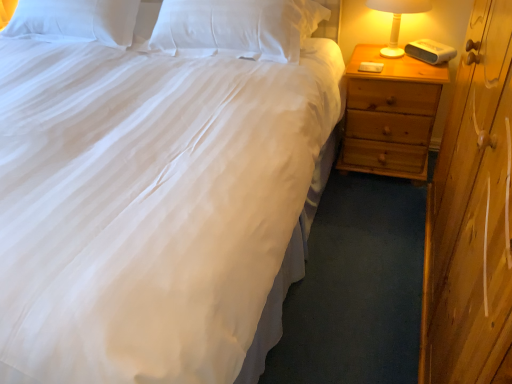
The image size is (512, 384). What do you see at coordinates (238, 26) in the screenshot?
I see `white soft pillow at upper center, the 2th pillow in the left-to-right sequence` at bounding box center [238, 26].

I want to click on white plastic lamp at right, so click(397, 19).

The height and width of the screenshot is (384, 512). Describe the element at coordinates (390, 115) in the screenshot. I see `light brown wood nightstand at right` at that location.

Image resolution: width=512 pixels, height=384 pixels. Find the location of `white soft pillow at upper center, the 2th pillow in the left-to-right sequence`. white soft pillow at upper center, the 2th pillow in the left-to-right sequence is located at coordinates (238, 26).

Image resolution: width=512 pixels, height=384 pixels. In order to click on bedside lamp located below the white soft pillow at upper left, the second pillow from the right (from the image's perspective) in this screenshot , I will do `click(397, 19)`.

Is point (381, 9) positioned after point (115, 34)?

No, (381, 9) is in front of (115, 34).

How many degrees apart are the facing directions of white plastic lamp at right and white soft pillow at upper left, acting as the 1th pillow starting from the left?

white plastic lamp at right and white soft pillow at upper left, acting as the 1th pillow starting from the left, are facing 0.000384 degrees away from each other.

Which is correct: white plastic lamp at right is inside white soft pillow at upper left, acting as the 1th pillow starting from the left, or outside of it?

white plastic lamp at right is located beyond the bounds of white soft pillow at upper left, acting as the 1th pillow starting from the left.

Is white soft pillow at upper left, the second pillow from the right, aimed at light brown wood nightstand at right?

No, white soft pillow at upper left, the second pillow from the right, is not oriented towards light brown wood nightstand at right.

Considering the relative sizes of white soft pillow at upper left, the second pillow from the right, and light brown wood nightstand at right in the image provided, is white soft pillow at upper left, the second pillow from the right, shorter than light brown wood nightstand at right?

Correct, white soft pillow at upper left, the second pillow from the right, is not as tall as light brown wood nightstand at right.

Would you consider white soft pillow at upper left, the second pillow from the right, to be distant from light brown wood nightstand at right?

Indeed, white soft pillow at upper left, the second pillow from the right, is not near light brown wood nightstand at right.

Identify the location of pillow in front of the light brown wood nightstand at right. This screenshot has height=384, width=512. (238, 26).

Which of these two, light brown wood nightstand at right or white soft pillow at upper center, the 2th pillow in the left-to-right sequence, is bigger?

With larger size is light brown wood nightstand at right.

Can you tell me how much light brown wood nightstand at right and white soft pillow at upper center, the 2th pillow in the left-to-right sequence, differ in facing direction?

2.29 degrees.

From their relative heights in the image, would you say light brown wood nightstand at right is taller or shorter than white soft pillow at upper center, which is the 1th pillow in right-to-left order?

In the image, light brown wood nightstand at right appears to be taller than white soft pillow at upper center, which is the 1th pillow in right-to-left order.

Considering the positions of point (27, 33) and point (210, 13), is point (27, 33) closer or farther from the camera than point (210, 13)?

Point (27, 33) is positioned farther from the camera compared to point (210, 13).

Is white soft pillow at upper left, acting as the 1th pillow starting from the left, aimed at white soft pillow at upper center, the 2th pillow in the left-to-right sequence?

No, white soft pillow at upper left, acting as the 1th pillow starting from the left, is not aimed at white soft pillow at upper center, the 2th pillow in the left-to-right sequence.

From the image's perspective, is white soft pillow at upper left, acting as the 1th pillow starting from the left, positioned above or below white soft pillow at upper center, the 2th pillow in the left-to-right sequence?

Clearly, from the image's perspective, white soft pillow at upper left, acting as the 1th pillow starting from the left, is above white soft pillow at upper center, the 2th pillow in the left-to-right sequence.

Does white soft pillow at upper left, acting as the 1th pillow starting from the left, have a smaller size compared to white soft pillow at upper center, which is the 1th pillow in right-to-left order?

Indeed, white soft pillow at upper left, acting as the 1th pillow starting from the left, has a smaller size compared to white soft pillow at upper center, which is the 1th pillow in right-to-left order.

Would you consider white soft pillow at upper center, which is the 1th pillow in right-to-left order, to be distant from white soft pillow at upper left, the second pillow from the right?

They are positioned close to each other.

Considering the positions of objects white soft pillow at upper center, the 2th pillow in the left-to-right sequence, and white soft pillow at upper left, the second pillow from the right, in the image provided, who is more to the right, white soft pillow at upper center, the 2th pillow in the left-to-right sequence, or white soft pillow at upper left, the second pillow from the right,?

white soft pillow at upper center, the 2th pillow in the left-to-right sequence.

Does point (284, 16) lie in front of point (38, 39)?

Yes, point (284, 16) is closer to viewer.

From the picture: From the image's perspective, is white soft pillow at upper center, which is the 1th pillow in right-to-left order, above white soft pillow at upper left, the second pillow from the right?

No.

From the image's perspective, is white plastic lamp at right above light brown wood nightstand at right?

Indeed, from the image's perspective, white plastic lamp at right is shown above light brown wood nightstand at right.

From their relative heights in the image, would you say white plastic lamp at right is taller or shorter than light brown wood nightstand at right?

white plastic lamp at right is shorter than light brown wood nightstand at right.

Can you confirm if white plastic lamp at right is smaller than light brown wood nightstand at right?

Indeed, white plastic lamp at right has a smaller size compared to light brown wood nightstand at right.

The width and height of the screenshot is (512, 384). There is a light brown wood nightstand at right. What are the coordinates of `bedside lamp above it (from a real-world perspective)` in the screenshot? It's located at (397, 19).

The image size is (512, 384). I want to click on pillow in front of the white plastic lamp at right, so click(238, 26).

Between white soft pillow at upper center, which is the 1th pillow in right-to-left order, and white plastic lamp at right, which one has smaller width?

With smaller width is white plastic lamp at right.

Based on the photo, from the image's perspective, does white soft pillow at upper center, the 2th pillow in the left-to-right sequence, appear lower than white plastic lamp at right?

No.

What's the angular difference between white soft pillow at upper center, the 2th pillow in the left-to-right sequence, and white plastic lamp at right's facing directions?

The angle between the facing direction of white soft pillow at upper center, the 2th pillow in the left-to-right sequence, and the facing direction of white plastic lamp at right is 0.000189 degrees.

This screenshot has width=512, height=384. In order to click on pillow behind the white plastic lamp at right in this screenshot , I will do `click(75, 21)`.

You are a GUI agent. You are given a task and a screenshot of the screen. Output one action in this format:
    pyautogui.click(x=<x>, y=<y>)
    Task: Click on the nightstand that appears on the right of white soft pillow at upper left, the second pillow from the right
    Image resolution: width=512 pixels, height=384 pixels.
    Given the screenshot: What is the action you would take?
    pyautogui.click(x=390, y=115)

In the scene shown: Looking at the image, which one is located further to white plastic lamp at right, light brown wood nightstand at right or white soft pillow at upper center, which is the 1th pillow in right-to-left order?

Among the two, white soft pillow at upper center, which is the 1th pillow in right-to-left order, is located further to white plastic lamp at right.

Considering their positions, is white soft pillow at upper left, the second pillow from the right, positioned further to light brown wood nightstand at right than white plastic lamp at right?

white soft pillow at upper left, the second pillow from the right, lies further to light brown wood nightstand at right than the other object.

Based on their spatial positions, is white soft pillow at upper center, the 2th pillow in the left-to-right sequence, or white soft pillow at upper left, acting as the 1th pillow starting from the left, closer to white plastic lamp at right?

The object closer to white plastic lamp at right is white soft pillow at upper center, the 2th pillow in the left-to-right sequence.

Looking at the image, which one is located further to white soft pillow at upper center, the 2th pillow in the left-to-right sequence, white soft pillow at upper left, acting as the 1th pillow starting from the left, or light brown wood nightstand at right?

light brown wood nightstand at right is positioned further to the anchor white soft pillow at upper center, the 2th pillow in the left-to-right sequence.

Looking at the image, which one is located closer to white soft pillow at upper left, the second pillow from the right, white plastic lamp at right or white soft pillow at upper center, which is the 1th pillow in right-to-left order?

Among the two, white soft pillow at upper center, which is the 1th pillow in right-to-left order, is located nearer to white soft pillow at upper left, the second pillow from the right.

Based on their spatial positions, is light brown wood nightstand at right or white plastic lamp at right closer to white soft pillow at upper left, acting as the 1th pillow starting from the left?

light brown wood nightstand at right is positioned closer to the anchor white soft pillow at upper left, acting as the 1th pillow starting from the left.

In the scene shown: When comparing their distances from white soft pillow at upper left, the second pillow from the right, does white soft pillow at upper center, which is the 1th pillow in right-to-left order, or white plastic lamp at right seem closer?

white soft pillow at upper center, which is the 1th pillow in right-to-left order.

From the image, which object appears to be farther from white soft pillow at upper center, which is the 1th pillow in right-to-left order, light brown wood nightstand at right or white plastic lamp at right?

light brown wood nightstand at right is positioned further to the anchor white soft pillow at upper center, which is the 1th pillow in right-to-left order.

I want to click on bedside lamp between white soft pillow at upper center, the 2th pillow in the left-to-right sequence, and light brown wood nightstand at right from left to right, so click(x=397, y=19).

The image size is (512, 384). What are the coordinates of `pillow between white soft pillow at upper left, the second pillow from the right, and white plastic lamp at right from left to right` in the screenshot? It's located at (238, 26).

This screenshot has width=512, height=384. In order to click on pillow located between white soft pillow at upper left, the second pillow from the right, and light brown wood nightstand at right in the left-right direction in this screenshot , I will do `click(238, 26)`.

You are a GUI agent. You are given a task and a screenshot of the screen. Output one action in this format:
    pyautogui.click(x=<x>, y=<y>)
    Task: Click on the bedside lamp located between white soft pillow at upper left, acting as the 1th pillow starting from the left, and light brown wood nightstand at right in the left-right direction
    The image size is (512, 384).
    Given the screenshot: What is the action you would take?
    pyautogui.click(x=397, y=19)